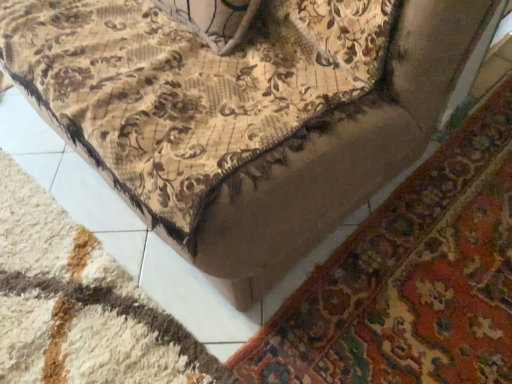
Question: Which is correct: beige textured mat at lower center, positioned as the 2th mat in right-to-left order, is inside floral fabric mat at lower right, which is the 2th mat from left to right, or outside of it?

Choices:
 (A) inside
 (B) outside

Answer: (B)

Question: From a real-world perspective, is beige textured mat at lower center, positioned as the 1th mat in left-to-right order, above or below floral fabric mat at lower right, which ranks as the first mat in right-to-left order?

Choices:
 (A) below
 (B) above

Answer: (B)

Question: Is beige textured mat at lower center, positioned as the 1th mat in left-to-right order, to the left or to the right of floral fabric mat at lower right, which is the 2th mat from left to right, in the image?

Choices:
 (A) left
 (B) right

Answer: (A)

Question: Considering the positions of floral fabric mat at lower right, which is the 2th mat from left to right, and beige textured mat at lower center, positioned as the 1th mat in left-to-right order, in the image, is floral fabric mat at lower right, which is the 2th mat from left to right, wider or thinner than beige textured mat at lower center, positioned as the 1th mat in left-to-right order,?

Choices:
 (A) wide
 (B) thin

Answer: (A)

Question: From the image's perspective, relative to beige textured mat at lower center, positioned as the 2th mat in right-to-left order, is floral fabric mat at lower right, which is the 2th mat from left to right, above or below?

Choices:
 (A) below
 (B) above

Answer: (B)

Question: Is floral fabric mat at lower right, which is the 2th mat from left to right, situated inside beige textured mat at lower center, positioned as the 2th mat in right-to-left order, or outside?

Choices:
 (A) inside
 (B) outside

Answer: (B)

Question: From a real-world perspective, relative to beige textured mat at lower center, positioned as the 1th mat in left-to-right order, is floral fabric mat at lower right, which ranks as the first mat in right-to-left order, vertically above or below?

Choices:
 (A) below
 (B) above

Answer: (A)